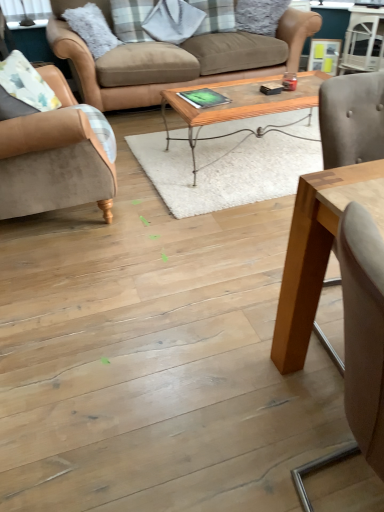
Question: Does woodenwoodencoffee table at center, arranged as the second coffee table when viewed from the front, turn towards suede beige armchair at left?

Choices:
 (A) yes
 (B) no

Answer: (B)

Question: From a real-world perspective, is woodenwoodencoffee table at center, the first coffee table viewed from the back, located higher than suede beige armchair at left?

Choices:
 (A) no
 (B) yes

Answer: (A)

Question: Does woodenwoodencoffee table at center, which is the 2th coffee table from bottom to top, appear on the left side of suede beige armchair at left?

Choices:
 (A) yes
 (B) no

Answer: (B)

Question: Is woodenwoodencoffee table at center, placed as the first coffee table when sorted from top to bottom, positioned far away from suede beige armchair at left?

Choices:
 (A) yes
 (B) no

Answer: (B)

Question: Is woodenwoodencoffee table at center, arranged as the second coffee table when viewed from the front, bigger than suede beige armchair at left?

Choices:
 (A) yes
 (B) no

Answer: (A)

Question: Is wooden table at center, which appears as the second coffee table when viewed from the top, to the left or to the right of suede beige armchair at left in the image?

Choices:
 (A) left
 (B) right

Answer: (B)

Question: Considering the positions of wooden table at center, which appears as the second coffee table when viewed from the top, and suede beige armchair at left in the image, is wooden table at center, which appears as the second coffee table when viewed from the top, bigger or smaller than suede beige armchair at left?

Choices:
 (A) big
 (B) small

Answer: (A)

Question: In terms of height, does wooden table at center, arranged as the first coffee table when viewed from the front, look taller or shorter compared to suede beige armchair at left?

Choices:
 (A) short
 (B) tall

Answer: (B)

Question: In terms of width, does wooden table at center, arranged as the first coffee table when viewed from the front, look wider or thinner when compared to suede beige armchair at left?

Choices:
 (A) thin
 (B) wide

Answer: (B)

Question: Is light brown wood swivel chair at right spatially inside wooden table at center, which is the first coffee table from bottom to top, or outside of it?

Choices:
 (A) inside
 (B) outside

Answer: (B)

Question: From the image's perspective, is light brown wood swivel chair at right positioned above or below wooden table at center, which is the first coffee table from bottom to top?

Choices:
 (A) below
 (B) above

Answer: (A)

Question: Considering the relative positions of light brown wood swivel chair at right and wooden table at center, which is the 2th coffee table in back-to-front order, in the image provided, is light brown wood swivel chair at right to the left or to the right of wooden table at center, which is the 2th coffee table in back-to-front order,?

Choices:
 (A) left
 (B) right

Answer: (A)

Question: Considering the positions of point (377, 389) and point (301, 247), is point (377, 389) closer or farther from the camera than point (301, 247)?

Choices:
 (A) closer
 (B) farther

Answer: (A)

Question: Is woodenwoodencoffee table at center, arranged as the second coffee table when viewed from the front, in front of or behind wooden table at center, which is the 2th coffee table in back-to-front order, in the image?

Choices:
 (A) front
 (B) behind

Answer: (B)

Question: From a real-world perspective, is woodenwoodencoffee table at center, arranged as the second coffee table when viewed from the front, positioned above or below wooden table at center, which is the 2th coffee table in back-to-front order?

Choices:
 (A) below
 (B) above

Answer: (A)